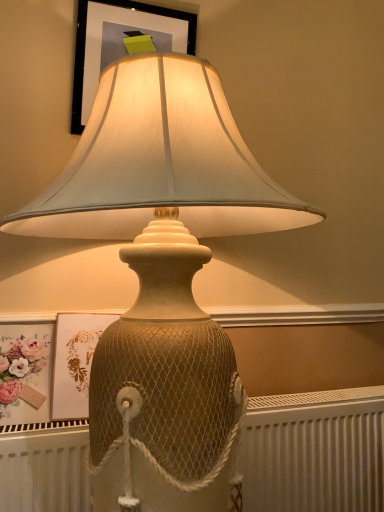
Question: Is matte gold picture frame at upper center, which appears as the second picture frame when viewed from the top, taller than white textured radiator at lower center?

Choices:
 (A) yes
 (B) no

Answer: (B)

Question: From the image's perspective, is matte gold picture frame at upper center, which appears as the second picture frame when viewed from the top, below white textured radiator at lower center?

Choices:
 (A) yes
 (B) no

Answer: (B)

Question: Can you confirm if matte gold picture frame at upper center, the 1th picture frame from the bottom, is wider than white textured radiator at lower center?

Choices:
 (A) no
 (B) yes

Answer: (A)

Question: Is matte gold picture frame at upper center, the 1th picture frame from the bottom, closer to camera compared to white textured radiator at lower center?

Choices:
 (A) no
 (B) yes

Answer: (A)

Question: Is matte gold picture frame at upper center, the 1th picture frame from the bottom, thinner than white textured radiator at lower center?

Choices:
 (A) no
 (B) yes

Answer: (B)

Question: Does matte gold picture frame at upper center, the 1th picture frame from the bottom, appear on the right side of white textured radiator at lower center?

Choices:
 (A) yes
 (B) no

Answer: (B)

Question: Is matte black frame at upper center, which is the first picture frame from top to bottom, positioned with its back to matte gold picture frame at upper center, which appears as the second picture frame when viewed from the top?

Choices:
 (A) yes
 (B) no

Answer: (B)

Question: Is matte black frame at upper center, placed as the 2th picture frame when sorted from bottom to top, bigger than matte gold picture frame at upper center, which appears as the second picture frame when viewed from the top?

Choices:
 (A) no
 (B) yes

Answer: (A)

Question: Considering the relative sizes of matte black frame at upper center, placed as the 2th picture frame when sorted from bottom to top, and matte gold picture frame at upper center, the 1th picture frame from the bottom, in the image provided, is matte black frame at upper center, placed as the 2th picture frame when sorted from bottom to top, smaller than matte gold picture frame at upper center, the 1th picture frame from the bottom,?

Choices:
 (A) yes
 (B) no

Answer: (A)

Question: Is matte black frame at upper center, which is the first picture frame from top to bottom, next to matte gold picture frame at upper center, which appears as the second picture frame when viewed from the top, and touching it?

Choices:
 (A) no
 (B) yes

Answer: (A)

Question: Does matte black frame at upper center, placed as the 2th picture frame when sorted from bottom to top, turn towards matte gold picture frame at upper center, which appears as the second picture frame when viewed from the top?

Choices:
 (A) yes
 (B) no

Answer: (B)

Question: Is the depth of matte black frame at upper center, which is the first picture frame from top to bottom, greater than that of matte gold picture frame at upper center, the 1th picture frame from the bottom?

Choices:
 (A) no
 (B) yes

Answer: (B)

Question: Considering the relative sizes of matte floral print at lower left and matte black frame at upper center, placed as the 2th picture frame when sorted from bottom to top, in the image provided, is matte floral print at lower left shorter than matte black frame at upper center, placed as the 2th picture frame when sorted from bottom to top,?

Choices:
 (A) yes
 (B) no

Answer: (A)